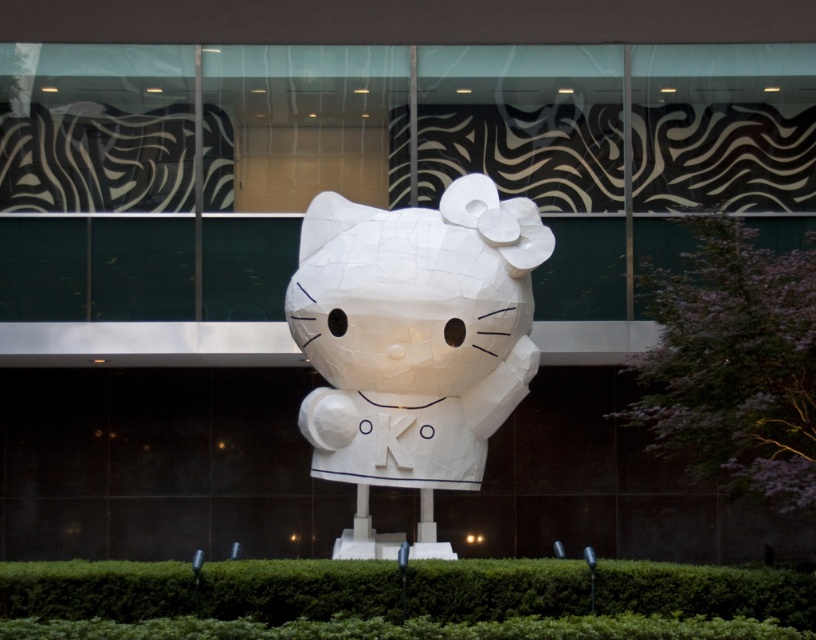
Describe the element at coordinates (413, 342) in the screenshot. I see `white paper sculpture at center` at that location.

Is white paper sculpture at center above green leafy hedge at center?

Correct, white paper sculpture at center is located above green leafy hedge at center.

At what (x,y) coordinates should I click in order to perform the action: click on white paper sculpture at center. Please return your answer as a coordinate pair (x, y). The width and height of the screenshot is (816, 640). Looking at the image, I should click on (413, 342).

Where is `white paper sculpture at center`? The image size is (816, 640). white paper sculpture at center is located at coordinates (413, 342).

Can you confirm if green leafy hedge at center is positioned to the left of green leafy hedge at right?

Indeed, green leafy hedge at center is positioned on the left side of green leafy hedge at right.

Consider the image. Who is positioned more to the right, green leafy hedge at center or green leafy hedge at right?

From the viewer's perspective, green leafy hedge at right appears more on the right side.

This screenshot has width=816, height=640. I want to click on green leafy hedge at center, so click(x=610, y=593).

Does white paper sculpture at center have a greater height compared to green leafy hedge at right?

Yes.

Is white paper sculpture at center above green leafy hedge at right?

Yes.

Is point (440, 404) positioned after point (657, 442)?

No, (440, 404) is in front of (657, 442).

At what (x,y) coordinates should I click in order to perform the action: click on white paper sculpture at center. Please return your answer as a coordinate pair (x, y). The image size is (816, 640). Looking at the image, I should click on (413, 342).